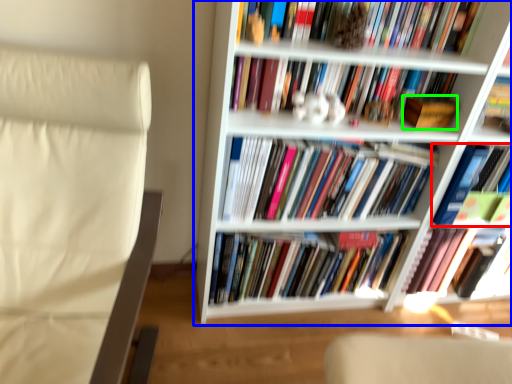
Question: Which is nearer to the book (highlighted by a red box)? bookcase (highlighted by a blue box) or paperback book (highlighted by a green box).

Choices:
 (A) bookcase
 (B) paperback book

Answer: (B)